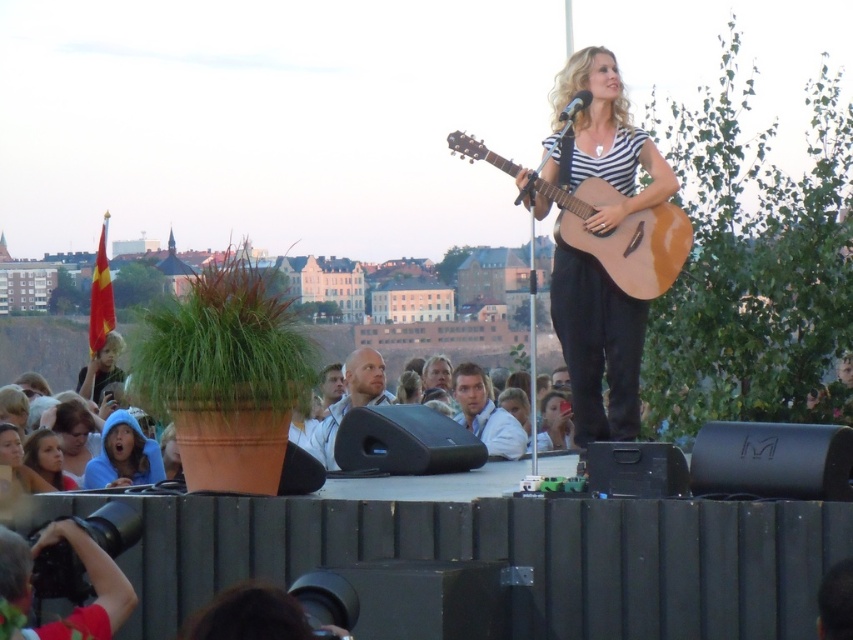
You are a photographer at the concert. You want to capture a photo of the singer holding the striped fabric guitar at center and ensure her blonde hair at center is visible in the shot. Can you position yourself in a way that both objects are in the frame without one blocking the other?

The striped fabric guitar at center is positioned over blonde hair at center, so if you position yourself to capture the singer holding the guitar, the guitar will block the view of her blonde hair at center. To ensure both are visible, adjust your angle so the guitar is slightly shifted to one side, allowing the hair to be seen beneath it.